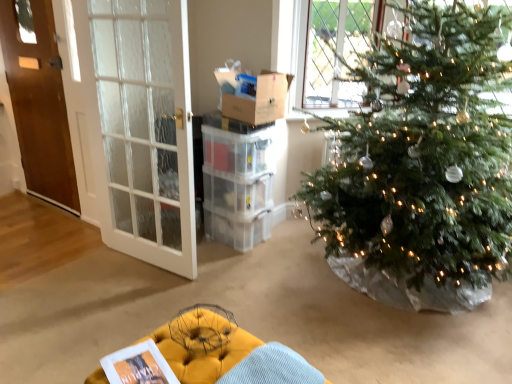
Question: Is yellow tufted ottoman at lower center not close to clear plastic crate at center?

Choices:
 (A) no
 (B) yes

Answer: (B)

Question: From the image's perspective, is yellow tufted ottoman at lower center beneath clear plastic crate at center?

Choices:
 (A) no
 (B) yes

Answer: (B)

Question: Is yellow tufted ottoman at lower center wider than clear plastic crate at center?

Choices:
 (A) yes
 (B) no

Answer: (A)

Question: From a real-world perspective, is yellow tufted ottoman at lower center below clear plastic crate at center?

Choices:
 (A) yes
 (B) no

Answer: (A)

Question: Is yellow tufted ottoman at lower center positioned before clear plastic crate at center?

Choices:
 (A) no
 (B) yes

Answer: (B)

Question: Considering the relative sizes of yellow tufted ottoman at lower center and clear plastic crate at center in the image provided, is yellow tufted ottoman at lower center thinner than clear plastic crate at center?

Choices:
 (A) yes
 (B) no

Answer: (B)

Question: Is clear plastic crate at center closer to camera compared to yellow tufted ottoman at lower center?

Choices:
 (A) yes
 (B) no

Answer: (B)

Question: Is clear plastic crate at center not near yellow tufted ottoman at lower center?

Choices:
 (A) no
 (B) yes

Answer: (B)

Question: From a real-world perspective, is clear plastic crate at center below yellow tufted ottoman at lower center?

Choices:
 (A) yes
 (B) no

Answer: (B)

Question: Can you confirm if clear plastic crate at center is wider than yellow tufted ottoman at lower center?

Choices:
 (A) yes
 (B) no

Answer: (B)

Question: Can you confirm if clear plastic crate at center is smaller than yellow tufted ottoman at lower center?

Choices:
 (A) yes
 (B) no

Answer: (A)

Question: Is clear plastic crate at center facing towards yellow tufted ottoman at lower center?

Choices:
 (A) no
 (B) yes

Answer: (A)

Question: Is yellow tufted ottoman at lower center bigger than cardboard box at upper center?

Choices:
 (A) yes
 (B) no

Answer: (A)